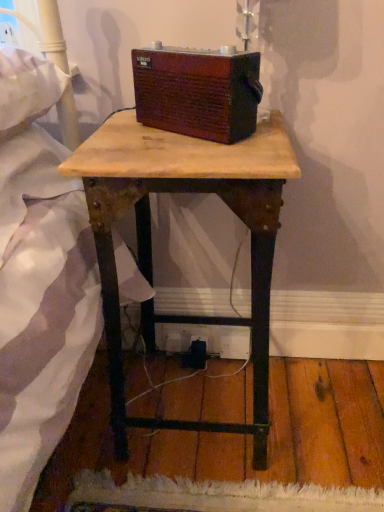
This screenshot has height=512, width=384. I want to click on free space below wooden table at center (from a real-world perspective), so click(x=200, y=400).